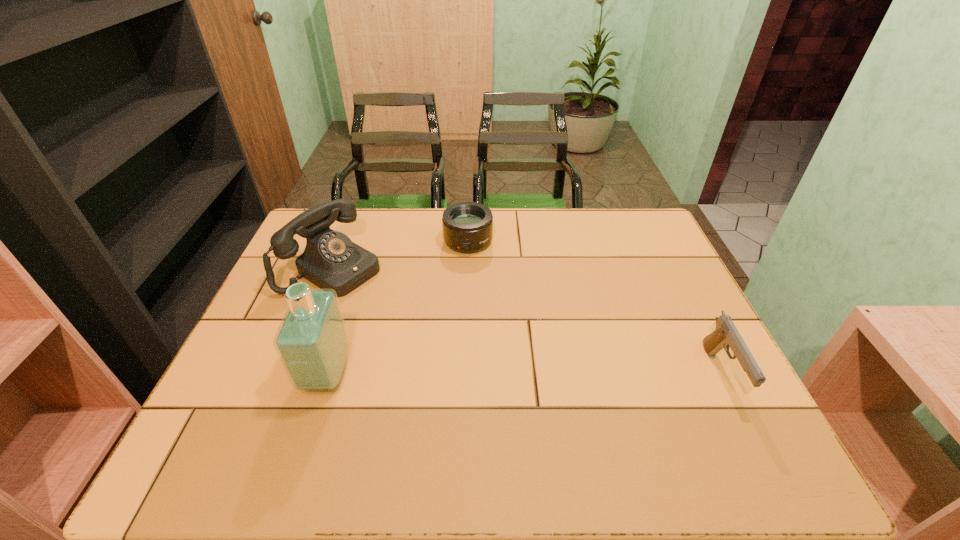
This screenshot has height=540, width=960. I want to click on object that is positioned at the right edge, so click(x=726, y=335).

You are a GUI agent. You are given a task and a screenshot of the screen. Output one action in this format:
    pyautogui.click(x=<x>, y=<y>)
    Task: Click on the object at the far left corner
    This screenshot has width=960, height=540.
    Given the screenshot: What is the action you would take?
    pyautogui.click(x=331, y=260)

Identify the location of object present at the near right corner. This screenshot has width=960, height=540. (726, 335).

In the image, there is a desktop. Identify the location of free space at the far edge. Image resolution: width=960 pixels, height=540 pixels. (510, 235).

Locate an element on the screen. vacant space at the left edge of the desktop is located at coordinates (280, 280).

Find the location of `vacant space at the right edge of the desktop`. vacant space at the right edge of the desktop is located at coordinates (667, 253).

This screenshot has width=960, height=540. Identify the location of free space at the near left corner. (214, 397).

Where is `vacant area that lies between the tallest object and the third object from left to right`? Image resolution: width=960 pixels, height=540 pixels. vacant area that lies between the tallest object and the third object from left to right is located at coordinates (397, 308).

The width and height of the screenshot is (960, 540). What are the coordinates of `vacant point located between the second tallest object and the rightmost object` in the screenshot? It's located at (527, 321).

Find the location of a particular element. Image resolution: width=960 pixels, height=540 pixels. empty space that is in between the shortest object and the rightmost object is located at coordinates (594, 308).